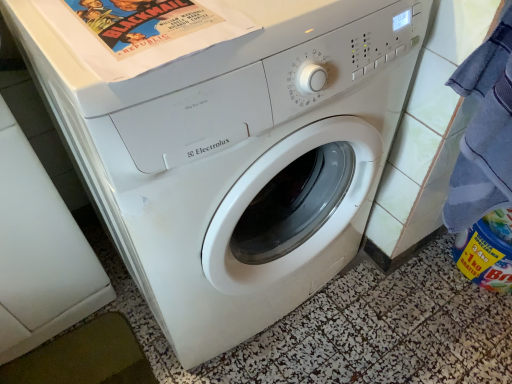
At what (x,y) coordinates should I click in order to perform the action: click on free spot below blue striped towel at right (from a real-world perspective). Please return your answer as a coordinate pair (x, y). The width and height of the screenshot is (512, 384). Looking at the image, I should click on (426, 294).